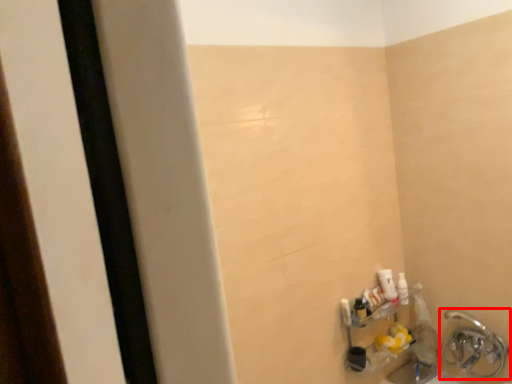
Question: Considering the relative positions of plumbing fixture (annotated by the red box) and toiletry in the image provided, where is plumbing fixture (annotated by the red box) located with respect to the staircase?

Choices:
 (A) left
 (B) right

Answer: (B)